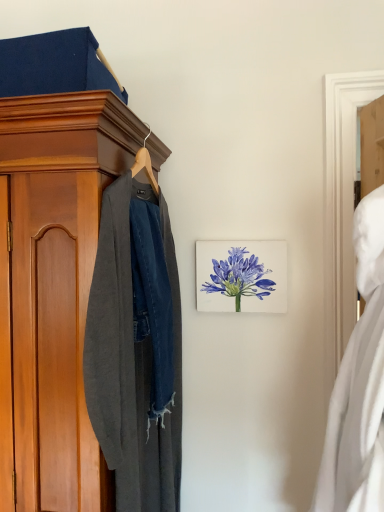
Question: Is dark gray wool coat at left positioned in front of watercolor blue flower at center?

Choices:
 (A) yes
 (B) no

Answer: (A)

Question: Considering the relative sizes of dark gray wool coat at left and watercolor blue flower at center in the image provided, is dark gray wool coat at left smaller than watercolor blue flower at center?

Choices:
 (A) yes
 (B) no

Answer: (B)

Question: Is dark gray wool coat at left shorter than watercolor blue flower at center?

Choices:
 (A) no
 (B) yes

Answer: (A)

Question: From the image's perspective, is dark gray wool coat at left over watercolor blue flower at center?

Choices:
 (A) no
 (B) yes

Answer: (A)

Question: From a real-world perspective, is dark gray wool coat at left located beneath watercolor blue flower at center?

Choices:
 (A) yes
 (B) no

Answer: (A)

Question: Is the depth of dark gray wool coat at left greater than that of watercolor blue flower at center?

Choices:
 (A) yes
 (B) no

Answer: (B)

Question: From a real-world perspective, does watercolor blue flower at center sit lower than white matte dress at right?

Choices:
 (A) no
 (B) yes

Answer: (A)

Question: Would you say white matte dress at right is part of watercolor blue flower at center's contents?

Choices:
 (A) yes
 (B) no

Answer: (B)

Question: Is watercolor blue flower at center closer to the viewer compared to white matte dress at right?

Choices:
 (A) yes
 (B) no

Answer: (B)

Question: Can you confirm if watercolor blue flower at center is taller than white matte dress at right?

Choices:
 (A) yes
 (B) no

Answer: (B)

Question: Are watercolor blue flower at center and white matte dress at right located far from each other?

Choices:
 (A) yes
 (B) no

Answer: (B)

Question: Does watercolor blue flower at center have a greater width compared to white matte dress at right?

Choices:
 (A) yes
 (B) no

Answer: (B)

Question: From the image's perspective, is white matte dress at right below dark gray wool coat at left?

Choices:
 (A) yes
 (B) no

Answer: (B)